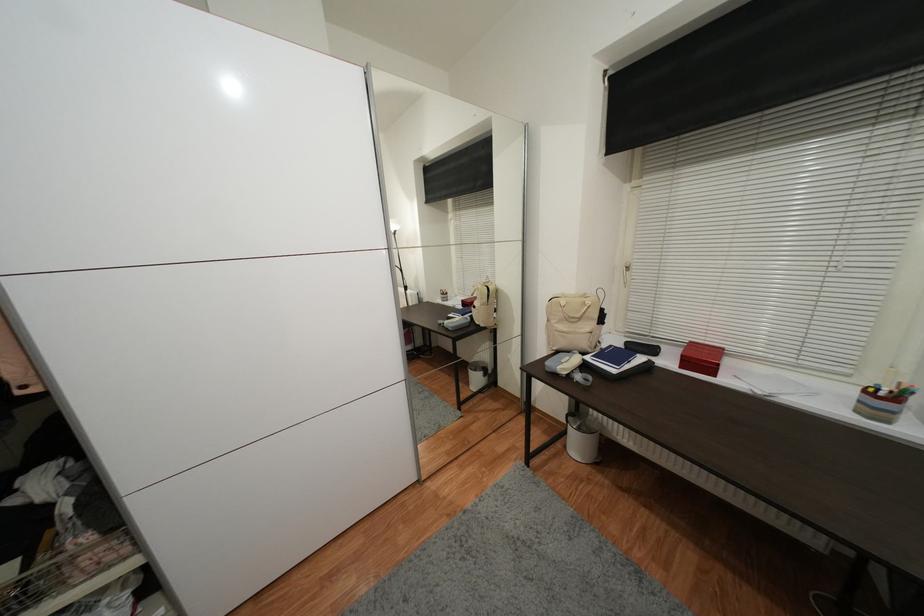
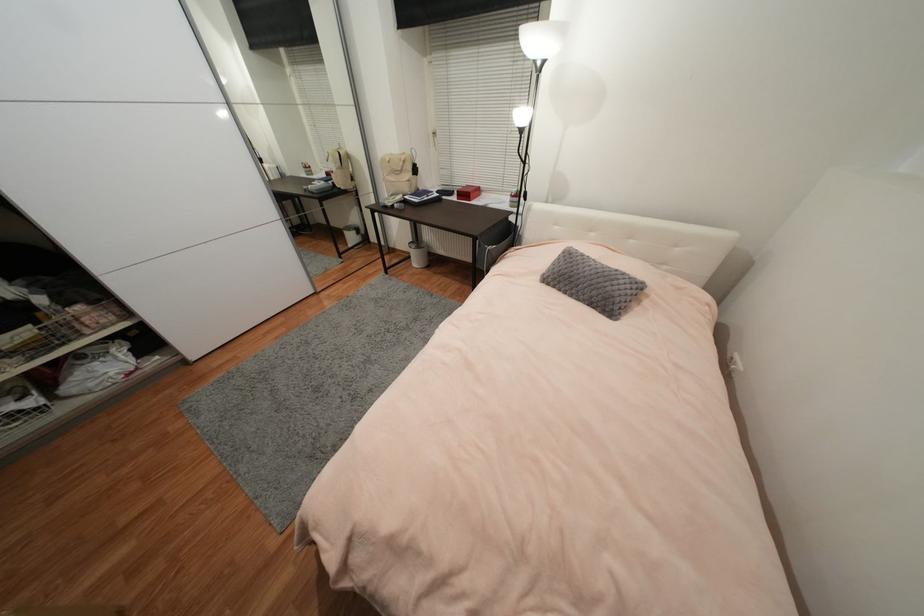
Locate, in the second image, the point that corresponds to [672,363] in the first image.

(458, 199)